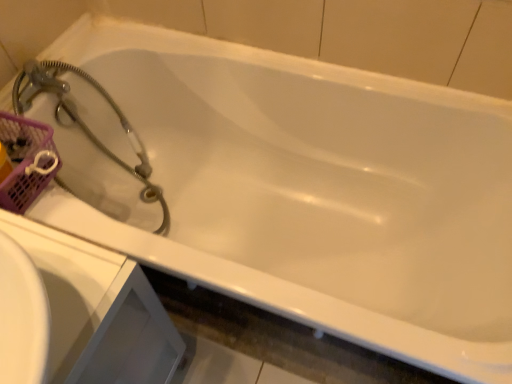
Question: Visually, is white glossy sink at lower left positioned to the left or to the right of satin silver hose at upper left?

Choices:
 (A) left
 (B) right

Answer: (B)

Question: From the image's perspective, relative to satin silver hose at upper left, is white glossy sink at lower left above or below?

Choices:
 (A) above
 (B) below

Answer: (B)

Question: Estimate the real-world distances between objects in this image. Which object is farther from the white glossy sink at lower left?

Choices:
 (A) pink mesh basket at upper left
 (B) satin silver hose at upper left

Answer: (B)

Question: Which object is positioned closest to the satin silver hose at upper left?

Choices:
 (A) white glossy sink at lower left
 (B) pink mesh basket at upper left

Answer: (B)